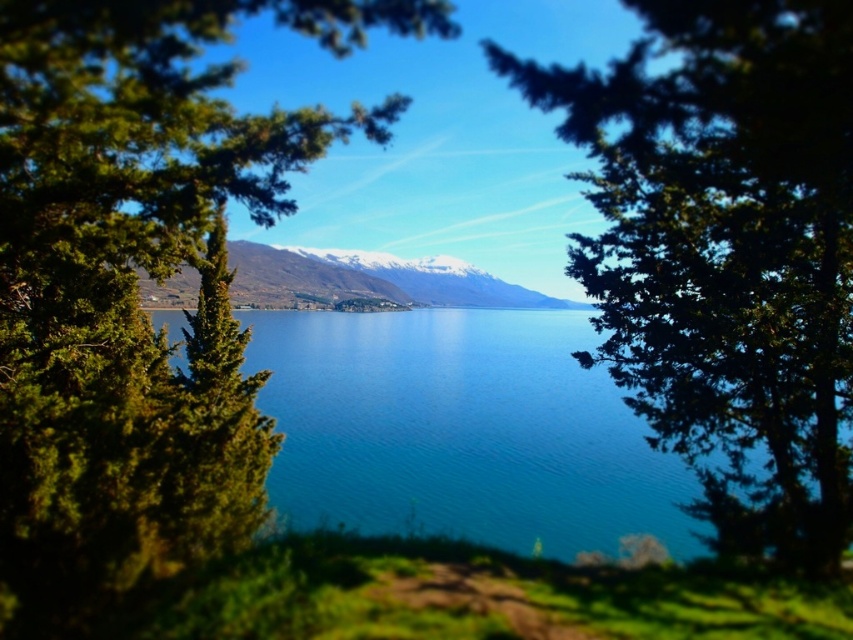
You are standing in the serene landscape and want to take a photo of both the green leafy tree at center and the green leafy tree at upper center. Which tree should you focus on first to ensure both are in clear view?

You should focus on the green leafy tree at upper center first because it is farther away than the green leafy tree at center, allowing both to be in focus when using a camera with a fixed focal point.

You are a photographer standing at the edge of the lake. You want to capture a photo that includes both the blue glassy water at center and the snowy mountain at center. Based on their positions, which object should you adjust your camera to focus on first to ensure both are in frame?

The blue glassy water at center is positioned on the right side of snowy mountain at center, so you should focus on the snowy mountain at center first to ensure both objects are included in the frame.